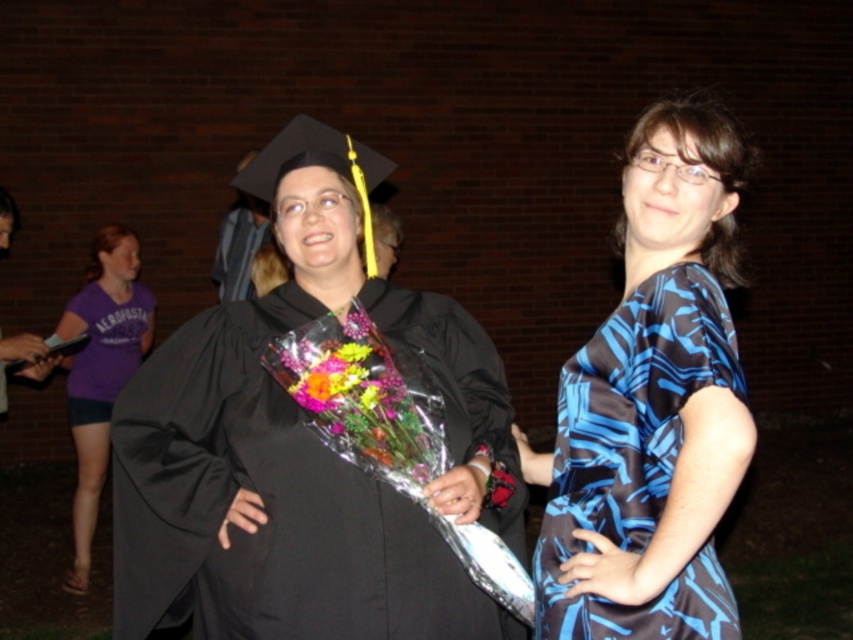
You are standing in the nighttime scene and want to place a small decoration between the two points, point 1 at (129, 284) and point 2 at (410, 424). Which point is closer to you so you can start placing the decoration from there?

Point 1 at (129, 284) is closer to you, so you can start placing the decoration from there.